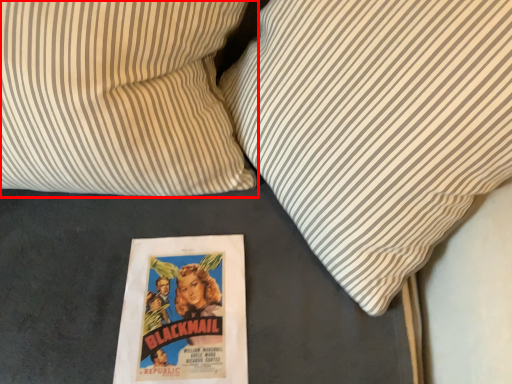
Question: In this image, where is pillow (annotated by the red box) located relative to pillow?

Choices:
 (A) right
 (B) left

Answer: (B)